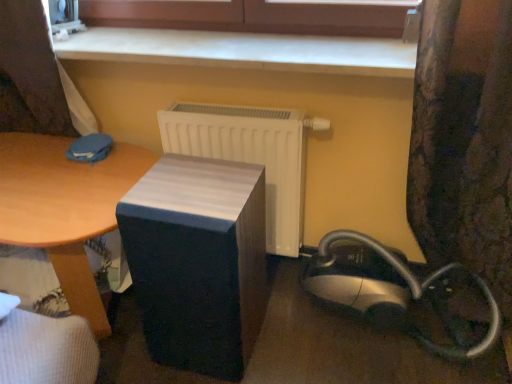
What do you see at coordinates (387, 290) in the screenshot?
I see `silver/black plastic vacuum cleaner at lower right` at bounding box center [387, 290].

Measure the distance between point [484,291] and camera.

The distance of point [484,291] from camera is 1.50 meters.

I want to click on smooth white surface at upper center, so [x=243, y=51].

You are a GUI agent. You are given a task and a screenshot of the screen. Output one action in this format:
    pyautogui.click(x=<x>, y=<y>)
    Task: Click on the wooden table at center
    The width and height of the screenshot is (512, 384).
    Given the screenshot: What is the action you would take?
    pyautogui.click(x=65, y=207)

In order to face white matte radiator at center, should I rotate leftwards or rightwards?

You should look left and rotate roughly 0.915 degrees.

The image size is (512, 384). What are the coordinates of `matte black speaker at center` in the screenshot? It's located at (198, 261).

Does white matte radiator at center turn towards wooden table at center?

No, white matte radiator at center is not oriented towards wooden table at center.

Would you consider white matte radiator at center to be distant from wooden table at center?

→ white matte radiator at center is actually quite close to wooden table at center.

Which point is more forward, (318, 119) or (57, 143)?

The point (318, 119) is closer to the camera.

Considering the sizes of white matte radiator at center and wooden table at center in the image, is white matte radiator at center taller or shorter than wooden table at center?

In the image, white matte radiator at center appears to be taller than wooden table at center.

From a real-world perspective, is wooden table at center above or below smooth white surface at upper center?

In terms of real-world spatial position, wooden table at center is below smooth white surface at upper center.

How many degrees apart are the facing directions of wooden table at center and smooth white surface at upper center?

0.0193 degrees.

Can you confirm if wooden table at center is shorter than smooth white surface at upper center?

Incorrect, the height of wooden table at center does not fall short of that of smooth white surface at upper center.

Does wooden table at center come in front of smooth white surface at upper center?

Yes.

Looking at this image, considering the sizes of silver/black plastic vacuum cleaner at lower right and smooth wood surface at upper center in the image, is silver/black plastic vacuum cleaner at lower right taller or shorter than smooth wood surface at upper center?

silver/black plastic vacuum cleaner at lower right is taller than smooth wood surface at upper center.

Measure the distance from silver/black plastic vacuum cleaner at lower right to smooth wood surface at upper center.

89.51 centimeters.

From the image's perspective, is silver/black plastic vacuum cleaner at lower right under smooth wood surface at upper center?

Yes.

Is there a large distance between silver/black plastic vacuum cleaner at lower right and smooth wood surface at upper center?

silver/black plastic vacuum cleaner at lower right is near smooth wood surface at upper center, not far away.

Which is more distant, (452, 43) or (373, 293)?

The point (373, 293) is farther from the camera.

At what (x,y) coordinates should I click in order to perform the action: click on curtain above the silver/black plastic vacuum cleaner at lower right (from a real-world perspective). Please return your answer as a coordinate pair (x, y). Looking at the image, I should click on (464, 140).

How many degrees apart are the facing directions of silver/black plastic vacuum cleaner at lower right and matte black speaker at center?

The angular difference between silver/black plastic vacuum cleaner at lower right and matte black speaker at center is 5.24 degrees.

From the image's perspective, is silver/black plastic vacuum cleaner at lower right above or below matte black speaker at center?

Clearly, from the image's perspective, silver/black plastic vacuum cleaner at lower right is below matte black speaker at center.

Is point (319, 258) closer to camera compared to point (155, 248)?

No.

Could you tell me if floral fabric curtain at right is turned towards smooth wood surface at upper center?

No.

In the scene shown: Considering the positions of objects floral fabric curtain at right and smooth wood surface at upper center in the image provided, who is in front, floral fabric curtain at right or smooth wood surface at upper center?

floral fabric curtain at right.

Which is farther, (495, 192) or (126, 17)?

Positioned behind is point (126, 17).

Which is in front, point (240, 15) or point (126, 187)?

Positioned in front is point (126, 187).

From the picture: Can you confirm if smooth wood surface at upper center is taller than wooden table at center?

In fact, smooth wood surface at upper center may be shorter than wooden table at center.

Is smooth wood surface at upper center not close to wooden table at center?

No, smooth wood surface at upper center is in close proximity to wooden table at center.

Could you tell me if smooth wood surface at upper center is facing wooden table at center?

No, smooth wood surface at upper center is not turned towards wooden table at center.

Image resolution: width=512 pixels, height=384 pixels. I want to click on table in front of the white matte radiator at center, so click(x=65, y=207).

There is a wooden table at center. Where is `counter top above it (from a real-world perspective)`? This screenshot has height=384, width=512. counter top above it (from a real-world perspective) is located at coordinates (243, 51).

Based on their spatial positions, is floral fabric curtain at right or wooden table at center closer to smooth wood surface at upper center?

floral fabric curtain at right is positioned closer to the anchor smooth wood surface at upper center.

Which object lies further to the anchor point smooth wood surface at upper center, smooth white surface at upper center or floral fabric curtain at right?

Among the two, floral fabric curtain at right is located further to smooth wood surface at upper center.

Based on the photo, looking at the image, which one is located further to smooth white surface at upper center, smooth wood surface at upper center or floral fabric curtain at right?

Based on the image, floral fabric curtain at right appears to be further to smooth white surface at upper center.

From the image, which object appears to be farther from smooth white surface at upper center, silver/black plastic vacuum cleaner at lower right or wooden table at center?

silver/black plastic vacuum cleaner at lower right.

From the image, which object appears to be farther from silver/black plastic vacuum cleaner at lower right, matte black speaker at center or floral fabric curtain at right?

matte black speaker at center.

Estimate the real-world distances between objects in this image. Which object is further from silver/black plastic vacuum cleaner at lower right, smooth wood surface at upper center or floral fabric curtain at right?

Among the two, smooth wood surface at upper center is located further to silver/black plastic vacuum cleaner at lower right.

Considering their positions, is smooth white surface at upper center positioned further to smooth wood surface at upper center than white matte radiator at center?

white matte radiator at center.

Considering their positions, is floral fabric curtain at right positioned closer to matte black speaker at center than white matte radiator at center?

white matte radiator at center is closer to matte black speaker at center.

This screenshot has height=384, width=512. I want to click on furniture that lies between smooth white surface at upper center and silver/black plastic vacuum cleaner at lower right from top to bottom, so click(198, 261).

Where is `radiator between wooden table at center and smooth white surface at upper center in the horizontal direction`? Image resolution: width=512 pixels, height=384 pixels. radiator between wooden table at center and smooth white surface at upper center in the horizontal direction is located at coordinates (251, 155).

Where is `counter top between wooden table at center and silver/black plastic vacuum cleaner at lower right from left to right`? The width and height of the screenshot is (512, 384). counter top between wooden table at center and silver/black plastic vacuum cleaner at lower right from left to right is located at coordinates (243, 51).

I want to click on furniture that lies between smooth wood surface at upper center and silver/black plastic vacuum cleaner at lower right from top to bottom, so click(198, 261).